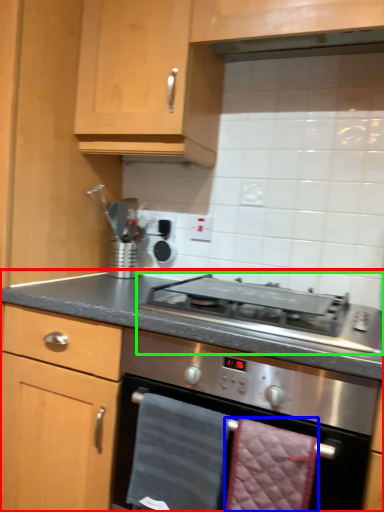
Question: Estimate the real-world distances between objects in this image. Which object is farther from countertop (highlighted by a red box), hand towel (highlighted by a blue box) or gas stove (highlighted by a green box)?

Choices:
 (A) hand towel
 (B) gas stove

Answer: (A)